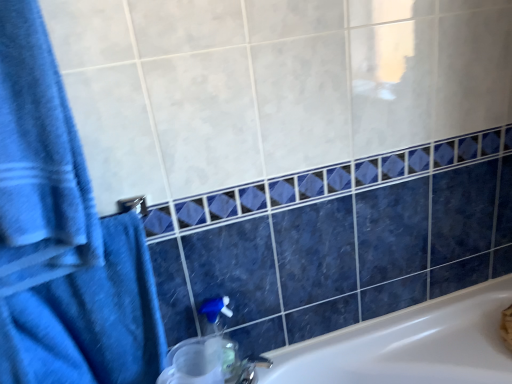
Question: Is blue cotton towel at left, the 2th bath towel in the bottom-to-top sequence, surrounded by translucent plastic soap dispenser at lower center?

Choices:
 (A) yes
 (B) no

Answer: (B)

Question: Does translucent plastic soap dispenser at lower center lie behind blue cotton towel at left, the 1th bath towel in the top-to-bottom sequence?

Choices:
 (A) yes
 (B) no

Answer: (A)

Question: Is translucent plastic soap dispenser at lower center with blue cotton towel at left, the 1th bath towel in the top-to-bottom sequence?

Choices:
 (A) no
 (B) yes

Answer: (A)

Question: Could you tell me if translucent plastic soap dispenser at lower center is turned towards blue cotton towel at left, the 1th bath towel in the top-to-bottom sequence?

Choices:
 (A) yes
 (B) no

Answer: (B)

Question: Can you confirm if translucent plastic soap dispenser at lower center is wider than blue cotton towel at left, the 1th bath towel in the top-to-bottom sequence?

Choices:
 (A) no
 (B) yes

Answer: (A)

Question: Does translucent plastic soap dispenser at lower center appear on the left side of blue cotton towel at left, the 1th bath towel in the top-to-bottom sequence?

Choices:
 (A) yes
 (B) no

Answer: (B)

Question: Is blue cotton towel at left, the 1th bath towel in the top-to-bottom sequence, thinner than translucent plastic soap dispenser at lower center?

Choices:
 (A) yes
 (B) no

Answer: (B)

Question: Would you say translucent plastic soap dispenser at lower center is part of blue cotton towel at left, the 2th bath towel in the bottom-to-top sequence,'s contents?

Choices:
 (A) yes
 (B) no

Answer: (B)

Question: Considering the relative sizes of blue cotton towel at left, the 1th bath towel in the top-to-bottom sequence, and translucent plastic soap dispenser at lower center in the image provided, is blue cotton towel at left, the 1th bath towel in the top-to-bottom sequence, smaller than translucent plastic soap dispenser at lower center?

Choices:
 (A) yes
 (B) no

Answer: (B)

Question: Is blue cotton towel at left, the 1th bath towel in the top-to-bottom sequence, located outside translucent plastic soap dispenser at lower center?

Choices:
 (A) yes
 (B) no

Answer: (A)

Question: Does blue cotton towel at left, the 2th bath towel in the bottom-to-top sequence, appear on the left side of translucent plastic soap dispenser at lower center?

Choices:
 (A) no
 (B) yes

Answer: (B)

Question: Does blue cotton towel at left, the 2th bath towel in the bottom-to-top sequence, have a larger size compared to translucent plastic soap dispenser at lower center?

Choices:
 (A) no
 (B) yes

Answer: (B)

Question: Is the position of blue cotton towel at left, the 2th bath towel in the bottom-to-top sequence, less distant than that of blue fabric towel at left, arranged as the first bath towel when ordered from the bottom?

Choices:
 (A) no
 (B) yes

Answer: (B)